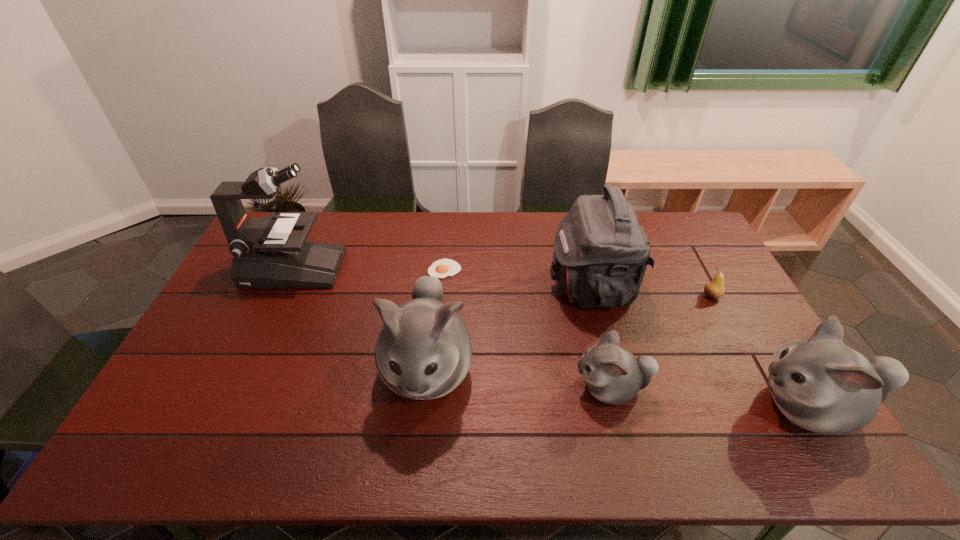
Locate an element on the screen. This screenshot has width=960, height=540. vacant space located on the face of the third shortest object is located at coordinates (490, 388).

Locate an element on the screen. free space located on the face of the third shortest object is located at coordinates (460, 388).

Locate an element on the screen. This screenshot has width=960, height=540. free spot located 0.400m on the face of the second shortest hamster is located at coordinates (592, 407).

Where is `vacant space located on the face of the second shortest hamster`? This screenshot has height=540, width=960. vacant space located on the face of the second shortest hamster is located at coordinates click(596, 407).

Where is `vacant space located 0.310m on the face of the second shortest hamster`? vacant space located 0.310m on the face of the second shortest hamster is located at coordinates pos(627,407).

Image resolution: width=960 pixels, height=540 pixels. I want to click on free region located 0.400m through the eyepieces of the microscope, so point(456,269).

Where is `vacant space situated 0.400m on the left of the sixth tallest object`? The image size is (960, 540). vacant space situated 0.400m on the left of the sixth tallest object is located at coordinates (578, 296).

The height and width of the screenshot is (540, 960). I want to click on vacant point located 0.390m on the open flap of the shoulder bag, so click(430, 286).

Where is `free spot located on the open flap of the shoulder bag`? Image resolution: width=960 pixels, height=540 pixels. free spot located on the open flap of the shoulder bag is located at coordinates (478, 286).

Locate an element on the screen. This screenshot has width=960, height=540. vacant space located on the open flap of the shoulder bag is located at coordinates (496, 286).